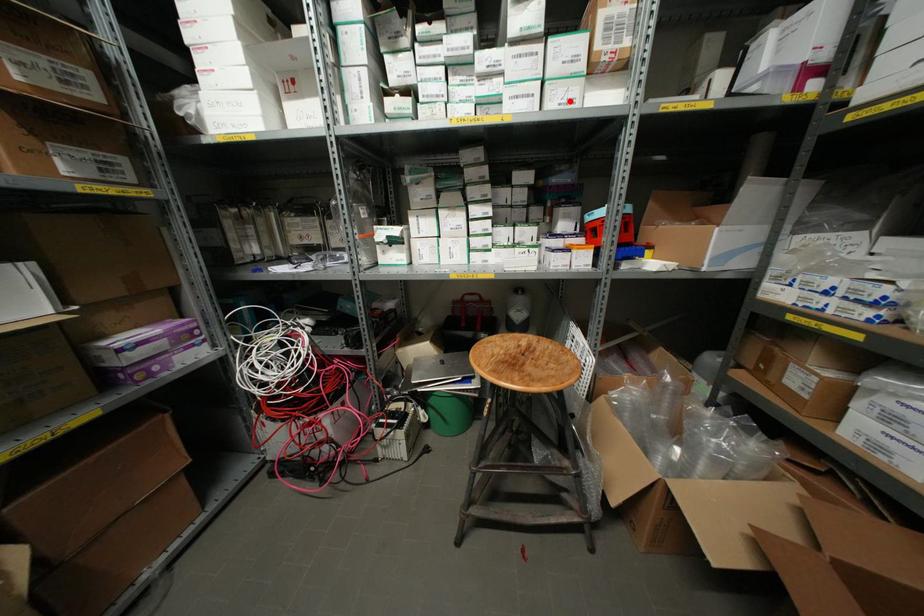
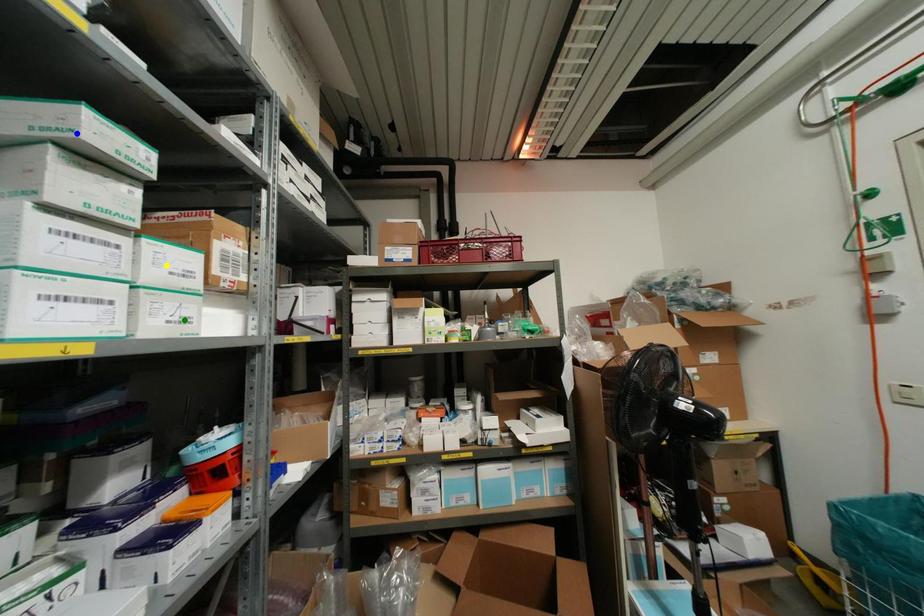
Question: I am providing you with two images of the same scene from different viewpoints. A red point is marked on the first image. You are given multiple points on the second image. Which point in image 2 represents the same 3d spot as the red point in image 1?

Choices:
 (A) blue point
 (B) yellow point
 (C) green point

Answer: (C)